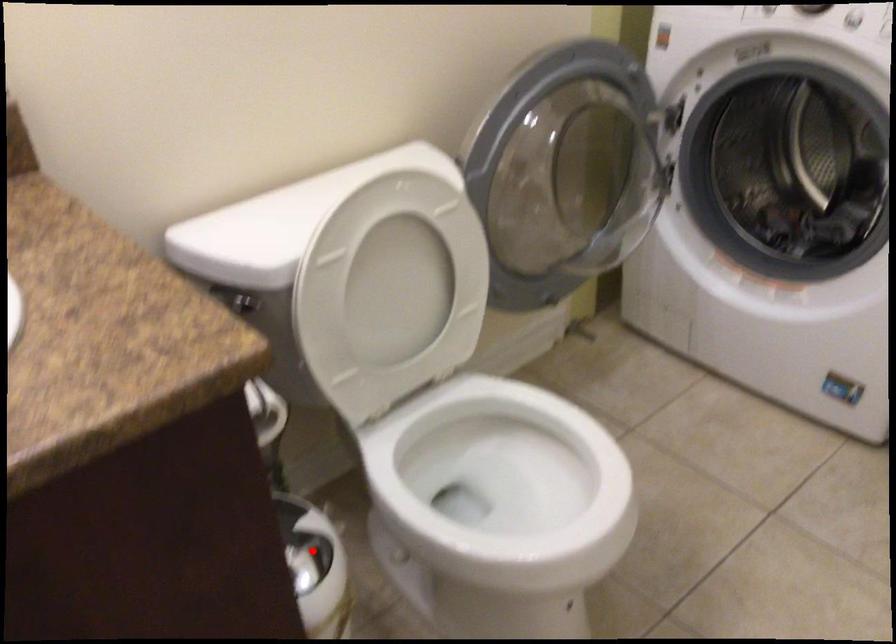
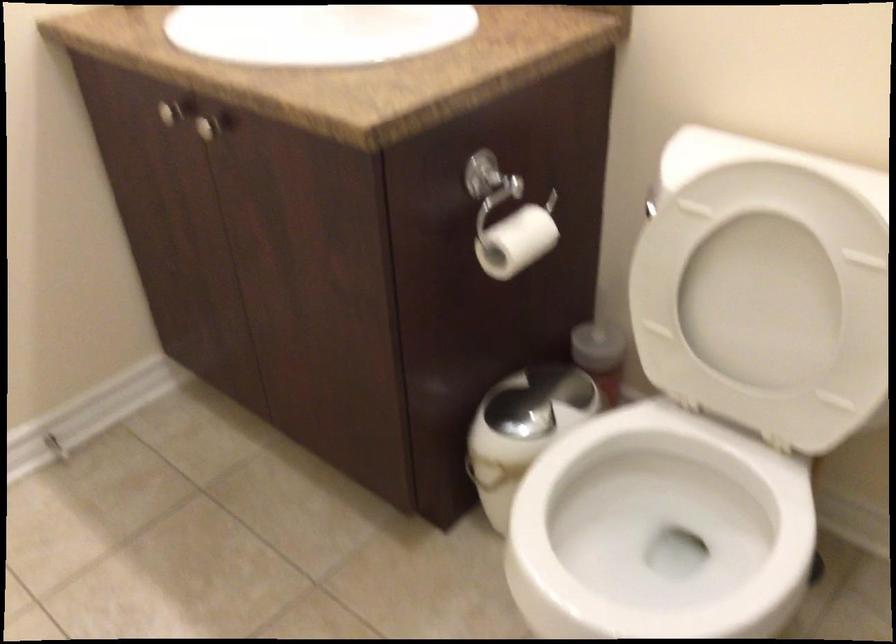
In the second image, find the point that corresponds to the highlighted location in the first image.

(529, 413)